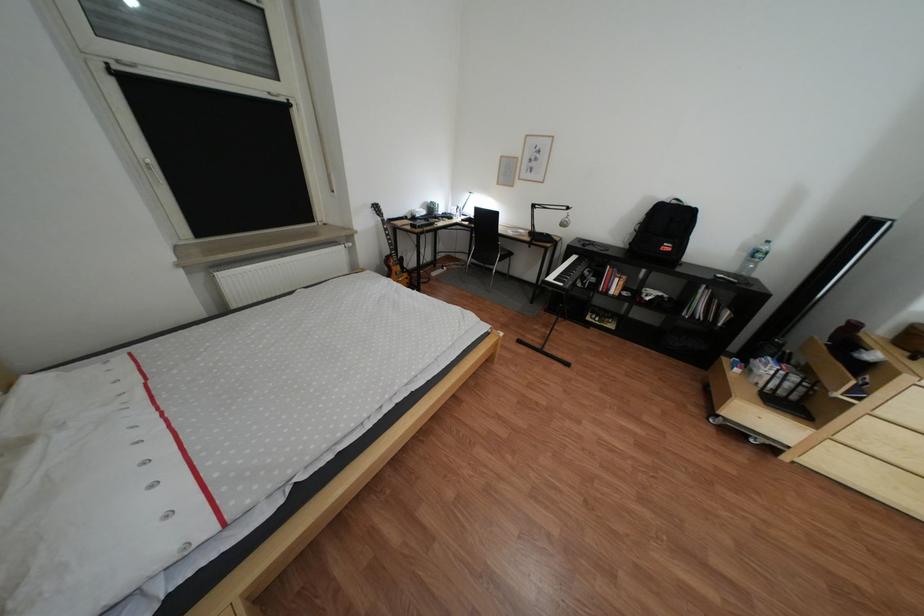
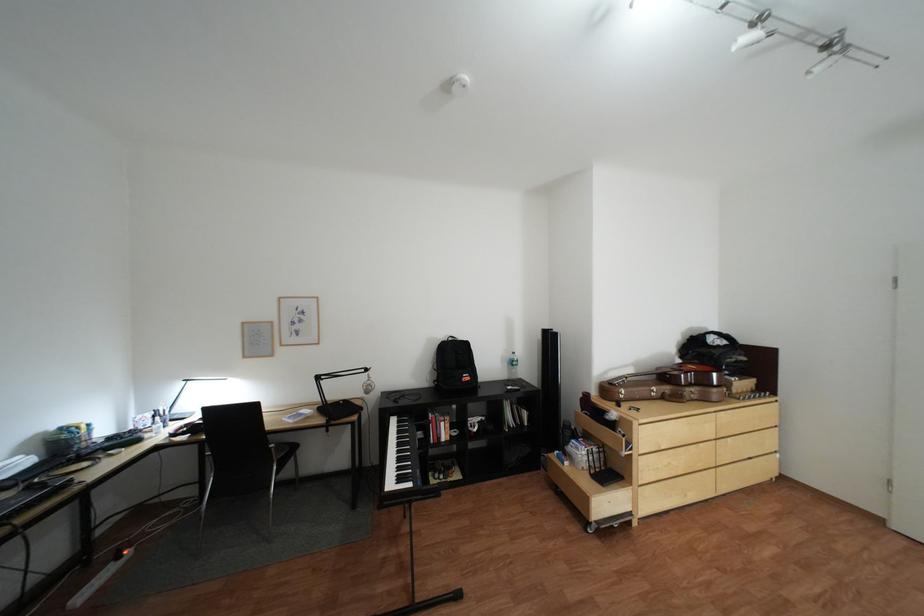
Question: I am providing you with two images of the same scene from different viewpoints. Please identify which objects are invisible in image2.

Choices:
 (A) clear water bottle
 (B) brown guitar case
 (C) black backpack
 (D) none of these

Answer: (D)